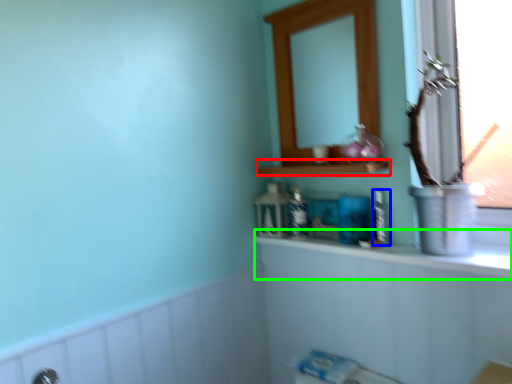
Question: Based on their relative distances, which object is farther from shelf (highlighted by a red box)? Choose from toiletry (highlighted by a blue box) and counter top (highlighted by a green box).

Choices:
 (A) toiletry
 (B) counter top

Answer: (B)